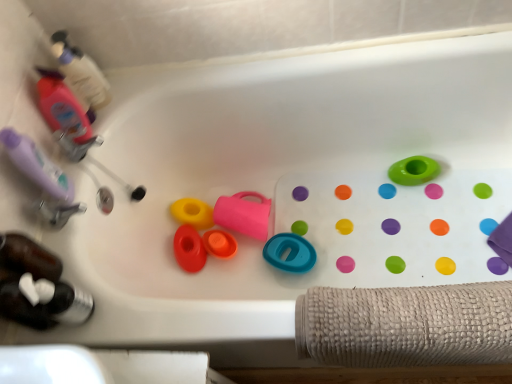
Where is `free space above pink rubber cup at center, which ranks as the third toy in right-to-left order (from a real-world perspective)`? This screenshot has height=384, width=512. free space above pink rubber cup at center, which ranks as the third toy in right-to-left order (from a real-world perspective) is located at coordinates (234, 211).